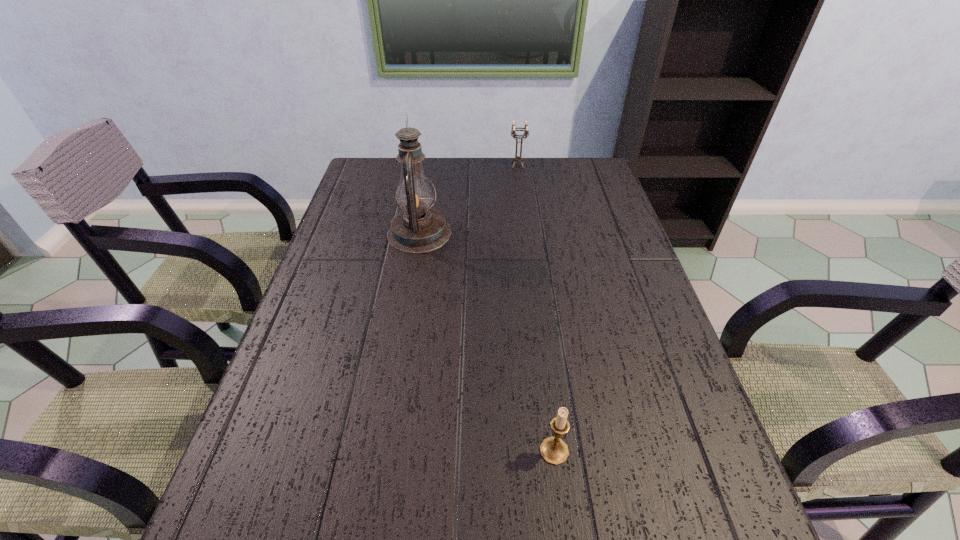
Locate an element on the screen. the leftmost object is located at coordinates (x=417, y=229).

Find the location of a particular element. The image size is (960, 540). the tallest object is located at coordinates (417, 229).

Identify the location of the farther candle holder. (526, 132).

You are a GUI agent. You are given a task and a screenshot of the screen. Output one action in this format:
    pyautogui.click(x=<x>, y=<y>)
    Task: Click on the nearer candle holder
    The width and height of the screenshot is (960, 540).
    Given the screenshot: What is the action you would take?
    pyautogui.click(x=554, y=450)

Image resolution: width=960 pixels, height=540 pixels. In order to click on vacant space positioned 0.350m on the back of the second farthest object in this screenshot , I will do `click(431, 159)`.

Locate an element on the screen. The height and width of the screenshot is (540, 960). free region located 0.320m on the left of the farther candle holder is located at coordinates (420, 165).

Find the location of a particular element. The width and height of the screenshot is (960, 540). vacant area situated on the back of the nearest object is located at coordinates (535, 300).

Where is `object positioned at the far edge`? object positioned at the far edge is located at coordinates (526, 132).

Image resolution: width=960 pixels, height=540 pixels. I want to click on object present at the left edge, so click(417, 229).

In order to click on vacant area at the far edge in this screenshot , I will do `click(544, 175)`.